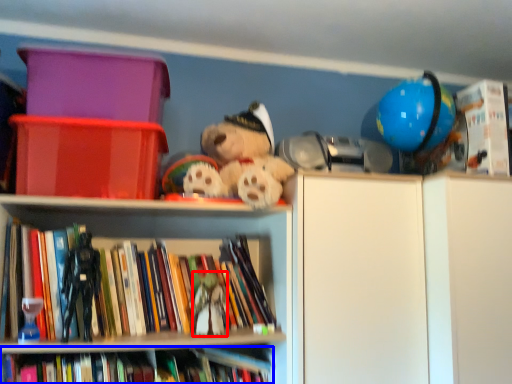
Question: Which point is closer to the camera, toy (highlighted by a red box) or book (highlighted by a blue box)?

Choices:
 (A) toy
 (B) book

Answer: (B)